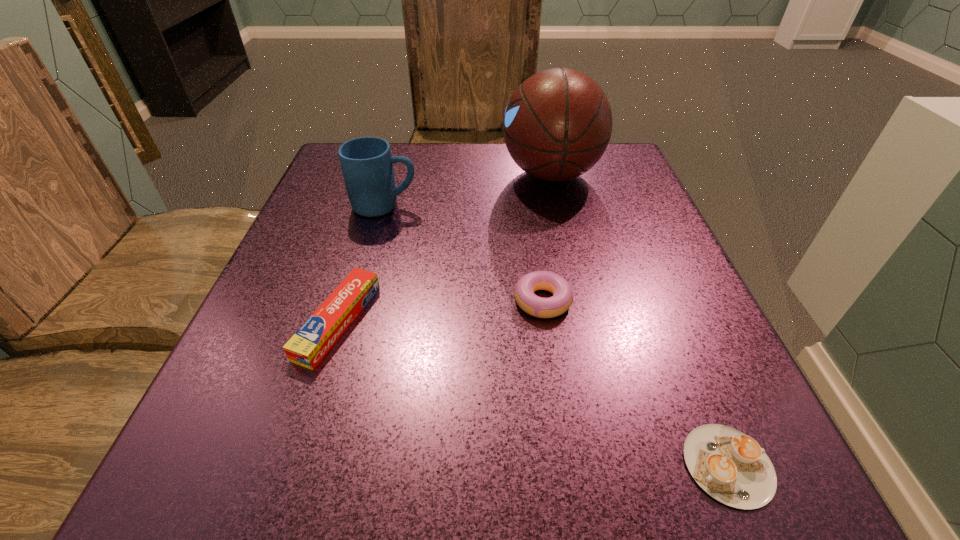
Where is `free spot between the cappuccino and the toothpaste`? The image size is (960, 540). free spot between the cappuccino and the toothpaste is located at coordinates (533, 393).

Where is `vacant space in between the basketball and the mug`? vacant space in between the basketball and the mug is located at coordinates [468, 190].

Image resolution: width=960 pixels, height=540 pixels. I want to click on free space that is in between the nearest object and the mug, so point(557,335).

What are the coordinates of `empty space between the toothpaste and the cappuccino` in the screenshot? It's located at (533, 393).

Find the location of `free space between the tallest object and the mug`. free space between the tallest object and the mug is located at coordinates click(468, 190).

This screenshot has height=540, width=960. In order to click on vacant region between the doughnut and the basketball in this screenshot , I will do `click(546, 237)`.

The height and width of the screenshot is (540, 960). Identify the location of object that is the closest to the doughnut. (731, 467).

Locate an element on the screen. the closest object to the doughnut is located at coordinates (731, 467).

Identify the location of free space that satisfies the following two spatial constraints: 1. on the back side of the doughnut; 2. on the left side of the toothpaste. This screenshot has height=540, width=960. (345, 300).

This screenshot has height=540, width=960. What are the coordinates of `free space that satisfies the following two spatial constraints: 1. on the front side of the basketball; 2. on the side of the mug with the handle` in the screenshot? It's located at [x=559, y=206].